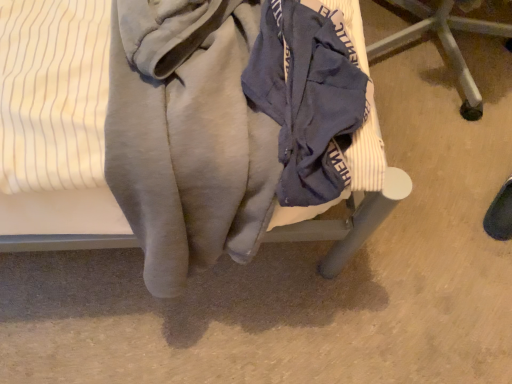
Question: Which direction should I rotate to look at blue fabric chair at center, which is the 2th furniture in left-to-right order?

Choices:
 (A) right
 (B) left

Answer: (A)

Question: Is the depth of velvet-like fabric chair at center, the first furniture in the left-to-right sequence, less than that of navy blue fabric at center?

Choices:
 (A) no
 (B) yes

Answer: (B)

Question: Is velvet-like fabric chair at center, the first furniture in the left-to-right sequence, not within navy blue fabric at center?

Choices:
 (A) no
 (B) yes

Answer: (B)

Question: Can you confirm if velvet-like fabric chair at center, the first furniture in the left-to-right sequence, is wider than navy blue fabric at center?

Choices:
 (A) yes
 (B) no

Answer: (A)

Question: From the image's perspective, is velvet-like fabric chair at center, the second furniture when ordered from right to left, under navy blue fabric at center?

Choices:
 (A) yes
 (B) no

Answer: (B)

Question: Is velvet-like fabric chair at center, the first furniture in the left-to-right sequence, shorter than navy blue fabric at center?

Choices:
 (A) yes
 (B) no

Answer: (B)

Question: Is velvet-like fabric chair at center, the first furniture in the left-to-right sequence, to the right of navy blue fabric at center from the viewer's perspective?

Choices:
 (A) yes
 (B) no

Answer: (B)

Question: Is blue fabric chair at center, which is counted as the first furniture, starting from the right, bigger than navy blue fabric at center?

Choices:
 (A) yes
 (B) no

Answer: (A)

Question: From the image's perspective, is blue fabric chair at center, which is the 2th furniture in left-to-right order, over navy blue fabric at center?

Choices:
 (A) no
 (B) yes

Answer: (B)

Question: From a real-world perspective, is blue fabric chair at center, which is counted as the first furniture, starting from the right, over navy blue fabric at center?

Choices:
 (A) yes
 (B) no

Answer: (B)

Question: Would you say blue fabric chair at center, which is counted as the first furniture, starting from the right, is outside navy blue fabric at center?

Choices:
 (A) no
 (B) yes

Answer: (B)

Question: From the image's perspective, is blue fabric chair at center, which is counted as the first furniture, starting from the right, beneath navy blue fabric at center?

Choices:
 (A) no
 (B) yes

Answer: (A)

Question: Is blue fabric chair at center, which is the 2th furniture in left-to-right order, wider than navy blue fabric at center?

Choices:
 (A) no
 (B) yes

Answer: (B)

Question: Can you confirm if velvet-like fabric chair at center, the second furniture when ordered from right to left, is taller than blue fabric chair at center, which is the 2th furniture in left-to-right order?

Choices:
 (A) no
 (B) yes

Answer: (B)